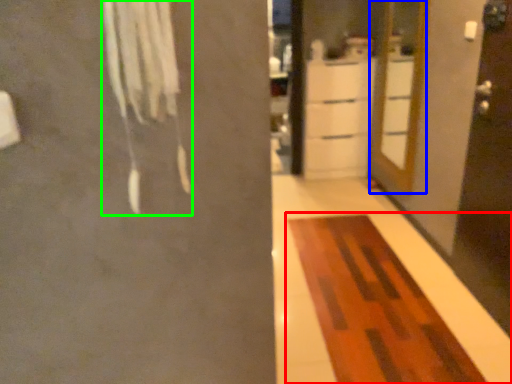
Question: Which is nearer to the furniture (highlighted by a red box)? door (highlighted by a blue box) or laundry (highlighted by a green box).

Choices:
 (A) door
 (B) laundry

Answer: (A)